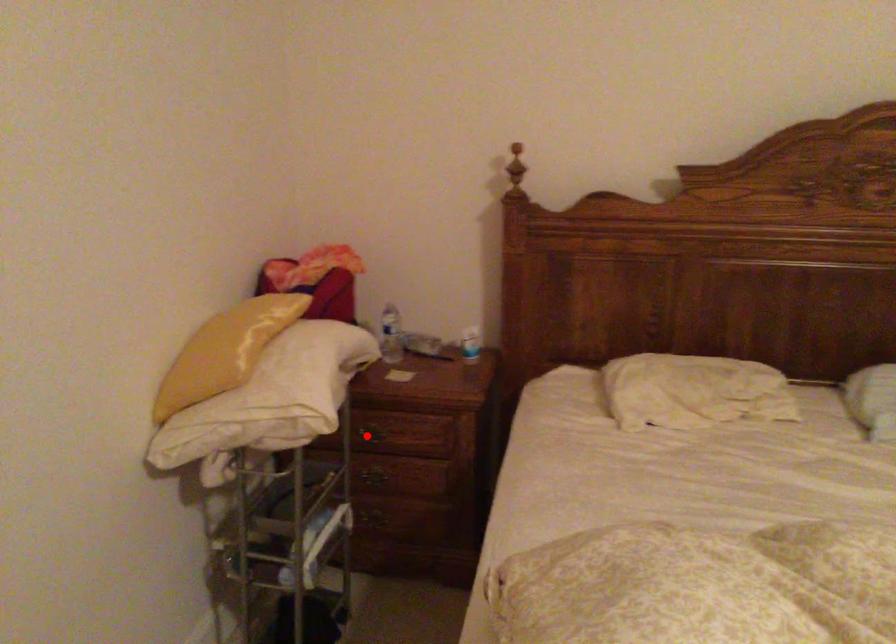
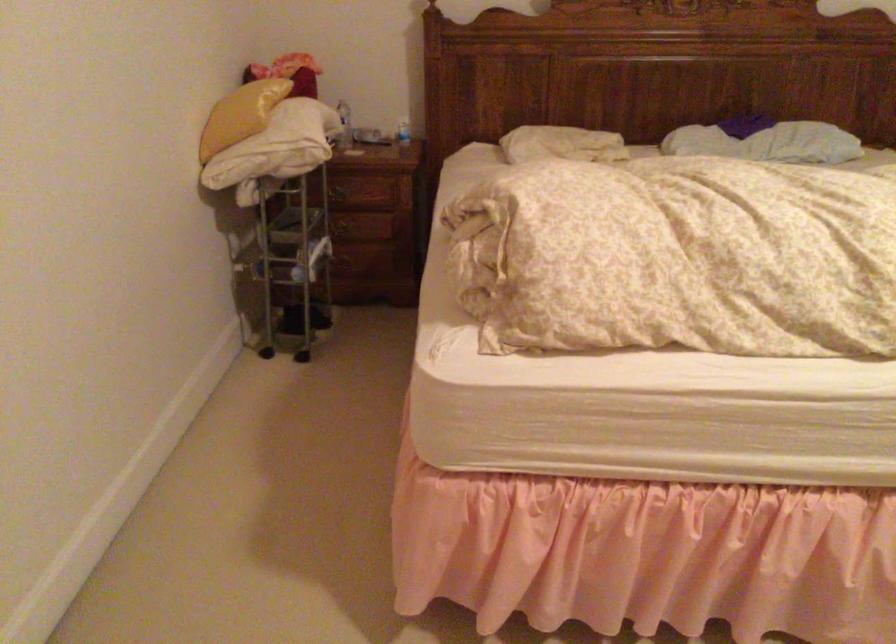
Find the pixel in the second image that matches the highlighted location in the first image.

(338, 194)